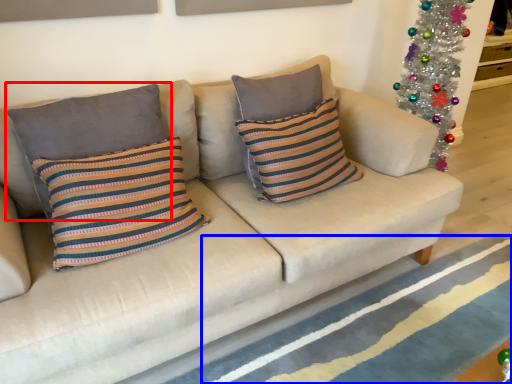
Question: Which point is further to the camera, pillow (highlighted by a red box) or stripe (highlighted by a blue box)?

Choices:
 (A) pillow
 (B) stripe

Answer: (A)